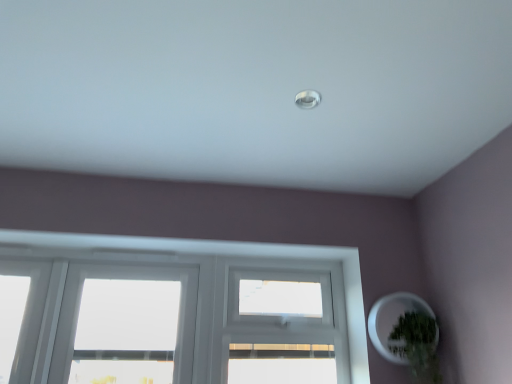
Question: From a real-world perspective, is white matte plant pot at lower right beneath green matte plant at lower right?

Choices:
 (A) no
 (B) yes

Answer: (A)

Question: Is white matte plant pot at lower right in contact with green matte plant at lower right?

Choices:
 (A) no
 (B) yes

Answer: (B)

Question: Considering the relative sizes of white matte plant pot at lower right and green matte plant at lower right in the image provided, is white matte plant pot at lower right taller than green matte plant at lower right?

Choices:
 (A) no
 (B) yes

Answer: (A)

Question: Is white matte plant pot at lower right to the right of green matte plant at lower right from the viewer's perspective?

Choices:
 (A) yes
 (B) no

Answer: (B)

Question: Are white matte plant pot at lower right and green matte plant at lower right located far from each other?

Choices:
 (A) yes
 (B) no

Answer: (B)

Question: Is white matte plant pot at lower right aimed at green matte plant at lower right?

Choices:
 (A) no
 (B) yes

Answer: (B)

Question: Considering the relative sizes of green matte plant at lower right and white matte plant pot at lower right in the image provided, is green matte plant at lower right bigger than white matte plant pot at lower right?

Choices:
 (A) no
 (B) yes

Answer: (A)

Question: From the image's perspective, is green matte plant at lower right located above white matte plant pot at lower right?

Choices:
 (A) yes
 (B) no

Answer: (B)

Question: Does green matte plant at lower right have a greater height compared to white matte plant pot at lower right?

Choices:
 (A) yes
 (B) no

Answer: (A)

Question: Is green matte plant at lower right located outside white matte plant pot at lower right?

Choices:
 (A) no
 (B) yes

Answer: (A)

Question: Considering the relative positions of green matte plant at lower right and white matte plant pot at lower right in the image provided, is green matte plant at lower right to the right of white matte plant pot at lower right from the viewer's perspective?

Choices:
 (A) yes
 (B) no

Answer: (A)

Question: Would you say green matte plant at lower right contains white matte plant pot at lower right?

Choices:
 (A) no
 (B) yes

Answer: (B)

Question: Visually, is green matte plant at lower right positioned to the left or to the right of white matte plant pot at lower right?

Choices:
 (A) right
 (B) left

Answer: (A)